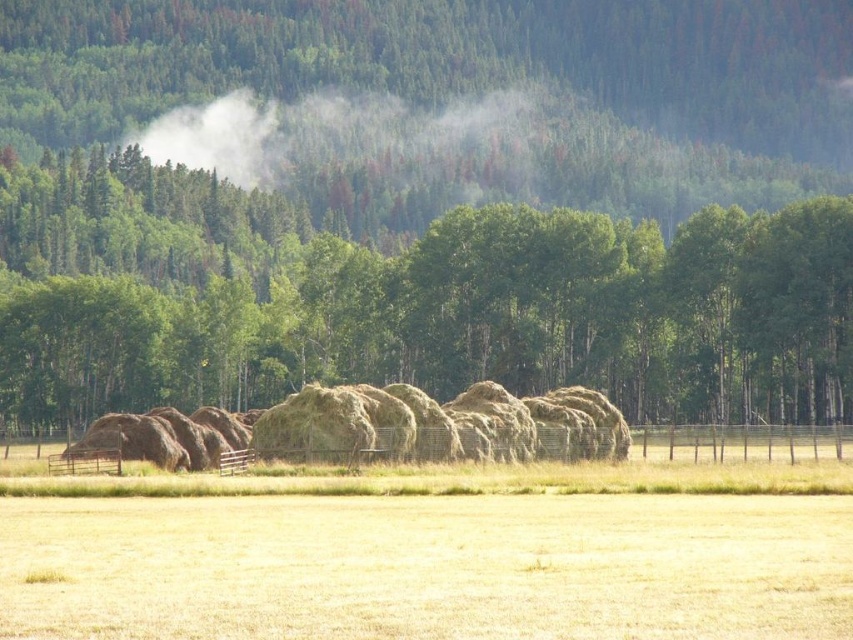
Question: From the image, what is the correct spatial relationship of dry grass at center in relation to white foggy cloud at upper center?

Choices:
 (A) right
 (B) left

Answer: (A)

Question: Can you confirm if green leafy tree at center is wider than dry grass at center?

Choices:
 (A) no
 (B) yes

Answer: (B)

Question: Is green leafy tree at center closer to camera compared to white foggy cloud at upper center?

Choices:
 (A) yes
 (B) no

Answer: (A)

Question: Among these points, which one is farthest from the camera?

Choices:
 (A) (434, 616)
 (B) (527, 102)

Answer: (B)

Question: Which point appears farthest from the camera in this image?

Choices:
 (A) (6, 577)
 (B) (418, 125)

Answer: (B)

Question: Which object is closer to the camera taking this photo?

Choices:
 (A) white foggy cloud at upper center
 (B) dry grass at center

Answer: (B)